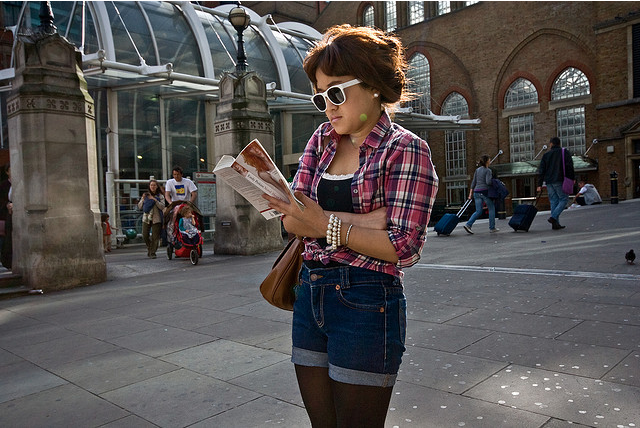
Locate an element on the screen. book is located at coordinates (249, 160).